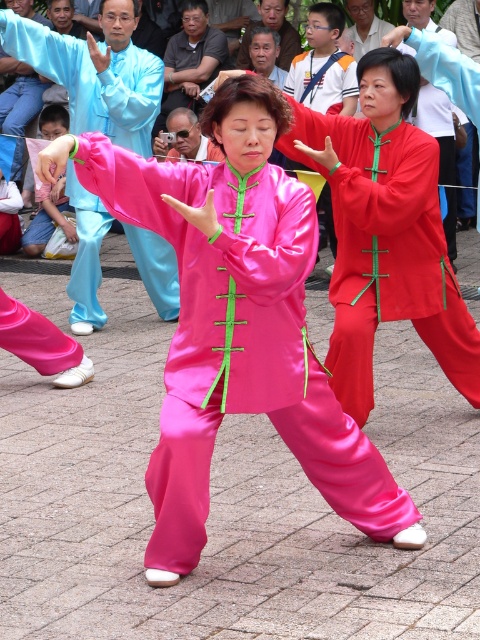
Based on the scene description, you are a photographer trying to capture a closeup of the smooth brown face at upper center and the light blue silk shirt at upper center. Which one should you focus on first if you want to ensure both are in focus?

The smooth brown face at upper center is taller than the light blue silk shirt at upper center, so you should focus on the smooth brown face at upper center first to ensure both are in focus.

You are observing a martial arts demonstration and notice two elements in the scene. The first is the silky red pants at center, and the second is the smooth brown face at upper center. From the perspective of someone standing in front of the performers, which of these two elements is positioned to the right of the other?

The silky red pants at center is to the right of the smooth brown face at upper center.

In the martial arts demonstration scene, there are two main objects of focus. The silky red pants at center and the smooth brown face at upper center. Which object is located lower in the image?

The silky red pants at center is positioned under the smooth brown face at upper center, so the silky red pants at center is lower in the image.